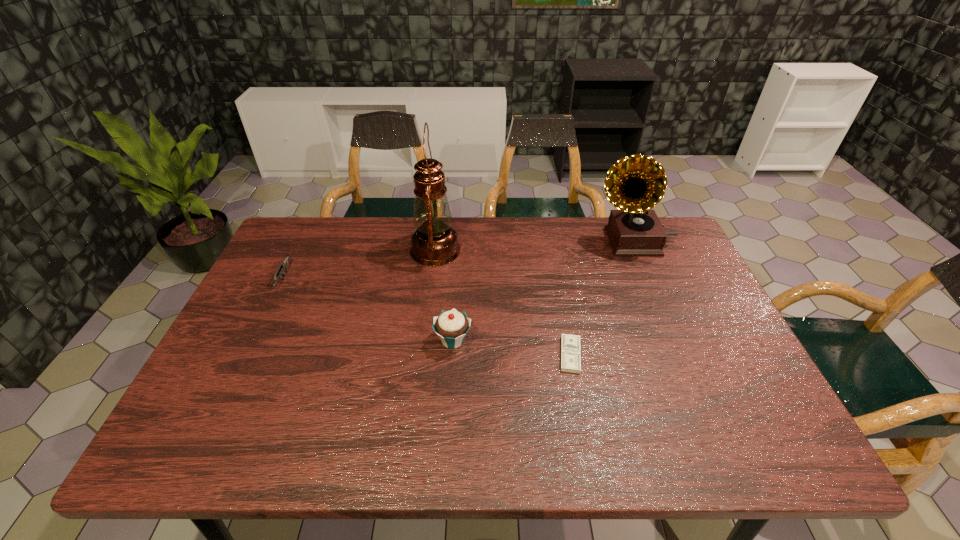
The width and height of the screenshot is (960, 540). In order to click on free space in the image that satisfies the following two spatial constraints: 1. on the front side of the oil lamp; 2. on the left side of the shortest object in this screenshot , I will do `click(422, 355)`.

Image resolution: width=960 pixels, height=540 pixels. I want to click on free space in the image that satisfies the following two spatial constraints: 1. aimed along the barrel of the third shortest object; 2. on the left side of the leftmost object, so click(x=253, y=340).

Image resolution: width=960 pixels, height=540 pixels. Find the location of `free spot that satisfies the following two spatial constraints: 1. aimed along the barrel of the cupcake; 2. on the left side of the fourth tallest object`. free spot that satisfies the following two spatial constraints: 1. aimed along the barrel of the cupcake; 2. on the left side of the fourth tallest object is located at coordinates (253, 340).

This screenshot has width=960, height=540. What are the coordinates of `vacant space that satisfies the following two spatial constraints: 1. aimed along the barrel of the cupcake; 2. on the left side of the leftmost object` in the screenshot? It's located at (253, 340).

You are a GUI agent. You are given a task and a screenshot of the screen. Output one action in this format:
    pyautogui.click(x=<x>, y=<y>)
    Task: Click on the vacant area that satisfies the following two spatial constraints: 1. aimed along the barrel of the leftmost object; 2. on the left side of the money
    
    Given the screenshot: What is the action you would take?
    pyautogui.click(x=246, y=355)

Where is `vacant region that satisfies the following two spatial constraints: 1. from the horn of the rightmost object; 2. aimed along the barrel of the second shortest object`? This screenshot has height=540, width=960. vacant region that satisfies the following two spatial constraints: 1. from the horn of the rightmost object; 2. aimed along the barrel of the second shortest object is located at coordinates (649, 279).